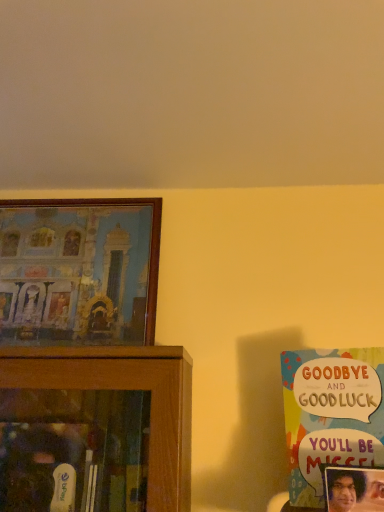
Question: Is matte plastic picture frame at lower right, positioned as the second picture frame in back-to-front order, oriented towards wooden framed painting at left, which appears as the 2th picture frame when ordered from the bottom?

Choices:
 (A) no
 (B) yes

Answer: (A)

Question: Can you confirm if matte plastic picture frame at lower right, acting as the first picture frame starting from the right, is taller than wooden framed painting at left, the first picture frame in the left-to-right sequence?

Choices:
 (A) yes
 (B) no

Answer: (B)

Question: From the image's perspective, is matte plastic picture frame at lower right, the 2th picture frame in the left-to-right sequence, on wooden framed painting at left, arranged as the 1th picture frame when viewed from the top?

Choices:
 (A) no
 (B) yes

Answer: (A)

Question: Is matte plastic picture frame at lower right, which appears as the first picture frame when viewed from the front, to the right of wooden framed painting at left, the first picture frame in the left-to-right sequence, from the viewer's perspective?

Choices:
 (A) yes
 (B) no

Answer: (A)

Question: Is matte plastic picture frame at lower right, the 2th picture frame in the left-to-right sequence, oriented away from wooden framed painting at left, the 2th picture frame from the right?

Choices:
 (A) no
 (B) yes

Answer: (A)

Question: In the image, is multicolored paper card at right positioned in front of or behind wooden framed painting at left, the first picture frame in the left-to-right sequence?

Choices:
 (A) behind
 (B) front

Answer: (B)

Question: From a real-world perspective, is multicolored paper card at right above or below wooden framed painting at left, which appears as the 2th picture frame when ordered from the bottom?

Choices:
 (A) above
 (B) below

Answer: (B)

Question: Does point (345, 451) appear closer or farther from the camera than point (127, 275)?

Choices:
 (A) closer
 (B) farther

Answer: (A)

Question: Is multicolored paper card at right situated inside wooden framed painting at left, which appears as the 2th picture frame when ordered from the bottom, or outside?

Choices:
 (A) inside
 (B) outside

Answer: (B)

Question: From the image's perspective, is matte plastic picture frame at lower right, positioned as the second picture frame in back-to-front order, positioned above or below multicolored paper card at right?

Choices:
 (A) below
 (B) above

Answer: (A)

Question: Is matte plastic picture frame at lower right, arranged as the 2th picture frame when viewed from the top, taller or shorter than multicolored paper card at right?

Choices:
 (A) tall
 (B) short

Answer: (B)

Question: Is matte plastic picture frame at lower right, the 2th picture frame in the left-to-right sequence, to the left or to the right of multicolored paper card at right in the image?

Choices:
 (A) left
 (B) right

Answer: (B)

Question: Is matte plastic picture frame at lower right, the first picture frame ordered from the bottom, inside or outside of multicolored paper card at right?

Choices:
 (A) inside
 (B) outside

Answer: (B)

Question: Considering the positions of wooden framed painting at left, which appears as the 2th picture frame when ordered from the bottom, and matte plastic picture frame at lower right, the 2th picture frame in the left-to-right sequence, in the image, is wooden framed painting at left, which appears as the 2th picture frame when ordered from the bottom, bigger or smaller than matte plastic picture frame at lower right, the 2th picture frame in the left-to-right sequence,?

Choices:
 (A) small
 (B) big

Answer: (B)

Question: From their relative heights in the image, would you say wooden framed painting at left, the 2th picture frame from the right, is taller or shorter than matte plastic picture frame at lower right, acting as the first picture frame starting from the right?

Choices:
 (A) tall
 (B) short

Answer: (A)